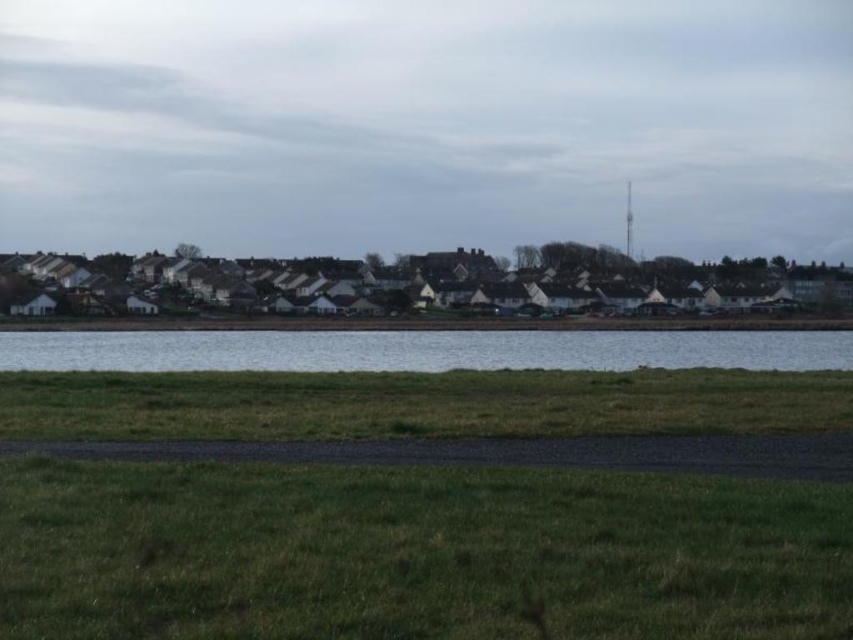
You are a gardener who wants to plant flowers in the green grass at lower center and clear water at center. Which location would require less soil depth due to the height of the object?

The green grass at lower center has a lesser height compared to the clear water at center, so planting flowers in the green grass at lower center would require less soil depth.

You are standing at the edge of the suburban landscape and want to walk towards the clear water at center. Is the green grass at lower center in your path?

The green grass at lower center is positioned under clear water at center, so the green grass at lower center is directly in your path towards the clear water at center.